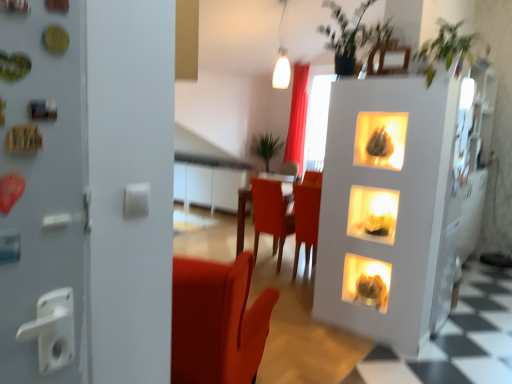
Question: Does matte brown fireplace at lower right, which appears as the first fireplace when ordered from the bottom, have a lesser width compared to green leafy plant at upper center, which appears as the second plant when viewed from the right?

Choices:
 (A) no
 (B) yes

Answer: (B)

Question: From a real-world perspective, is matte brown fireplace at lower right, marked as the second fireplace in a top-to-bottom arrangement, below green leafy plant at upper center, marked as the second plant in a left-to-right arrangement?

Choices:
 (A) no
 (B) yes

Answer: (B)

Question: Would you consider matte brown fireplace at lower right, marked as the second fireplace in a top-to-bottom arrangement, to be distant from green leafy plant at upper center, which appears as the second plant when viewed from the right?

Choices:
 (A) no
 (B) yes

Answer: (B)

Question: Considering the relative positions of matte brown fireplace at lower right, marked as the second fireplace in a top-to-bottom arrangement, and green leafy plant at upper center, marked as the second plant in a left-to-right arrangement, in the image provided, is matte brown fireplace at lower right, marked as the second fireplace in a top-to-bottom arrangement, in front of green leafy plant at upper center, marked as the second plant in a left-to-right arrangement,?

Choices:
 (A) no
 (B) yes

Answer: (A)

Question: Considering the relative sizes of matte brown fireplace at lower right, which appears as the first fireplace when ordered from the bottom, and green leafy plant at upper center, which ranks as the 2th plant in front-to-back order, in the image provided, is matte brown fireplace at lower right, which appears as the first fireplace when ordered from the bottom, smaller than green leafy plant at upper center, which ranks as the 2th plant in front-to-back order,?

Choices:
 (A) yes
 (B) no

Answer: (A)

Question: Is green leafy plant at upper right, the third plant from the left, situated inside wooden table at center or outside?

Choices:
 (A) outside
 (B) inside

Answer: (A)

Question: Is point (448, 36) positioned closer to the camera than point (237, 238)?

Choices:
 (A) farther
 (B) closer

Answer: (B)

Question: From the image's perspective, is green leafy plant at upper right, the third plant from the left, above or below wooden table at center?

Choices:
 (A) below
 (B) above

Answer: (B)

Question: From a real-world perspective, relative to wooden table at center, is green leafy plant at upper right, which appears as the 3th plant when viewed from the back, vertically above or below?

Choices:
 (A) above
 (B) below

Answer: (A)

Question: Is green leafy plant at upper right, the third plant from the left, wider or thinner than red velvet curtain at upper center?

Choices:
 (A) wide
 (B) thin

Answer: (A)

Question: From the image's perspective, is green leafy plant at upper right, the first plant viewed from the right, positioned above or below red velvet curtain at upper center?

Choices:
 (A) below
 (B) above

Answer: (A)

Question: Is green leafy plant at upper right, the first plant viewed from the right, situated inside red velvet curtain at upper center or outside?

Choices:
 (A) inside
 (B) outside

Answer: (B)

Question: From a real-world perspective, is green leafy plant at upper right, which is the first plant in front-to-back order, physically located above or below red velvet curtain at upper center?

Choices:
 (A) below
 (B) above

Answer: (B)

Question: Considering the relative positions of green leafy plant at upper center, which is counted as the second plant, starting from the back, and red velvet curtain at upper center in the image provided, is green leafy plant at upper center, which is counted as the second plant, starting from the back, to the left or to the right of red velvet curtain at upper center?

Choices:
 (A) right
 (B) left

Answer: (A)

Question: Is green leafy plant at upper center, which is counted as the second plant, starting from the back, in front of or behind red velvet curtain at upper center in the image?

Choices:
 (A) front
 (B) behind

Answer: (A)